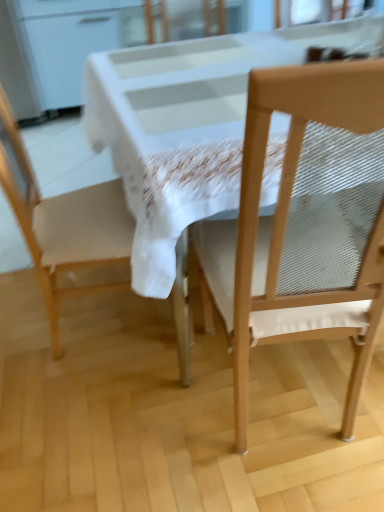
I want to click on free space in front of matte white chair at left, positioned as the first chair in left-to-right order, so click(x=105, y=410).